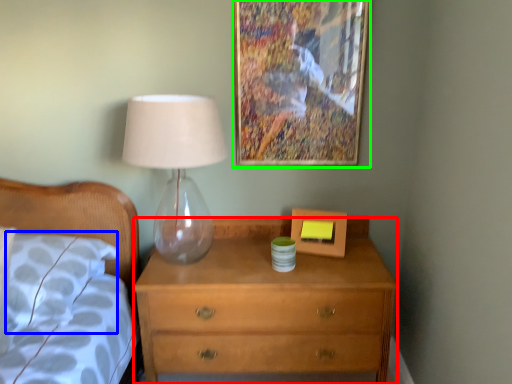
Question: Which is farther away from chest of drawers (highlighted by a red box)? pillow (highlighted by a blue box) or picture frame (highlighted by a green box)?

Choices:
 (A) pillow
 (B) picture frame

Answer: (B)